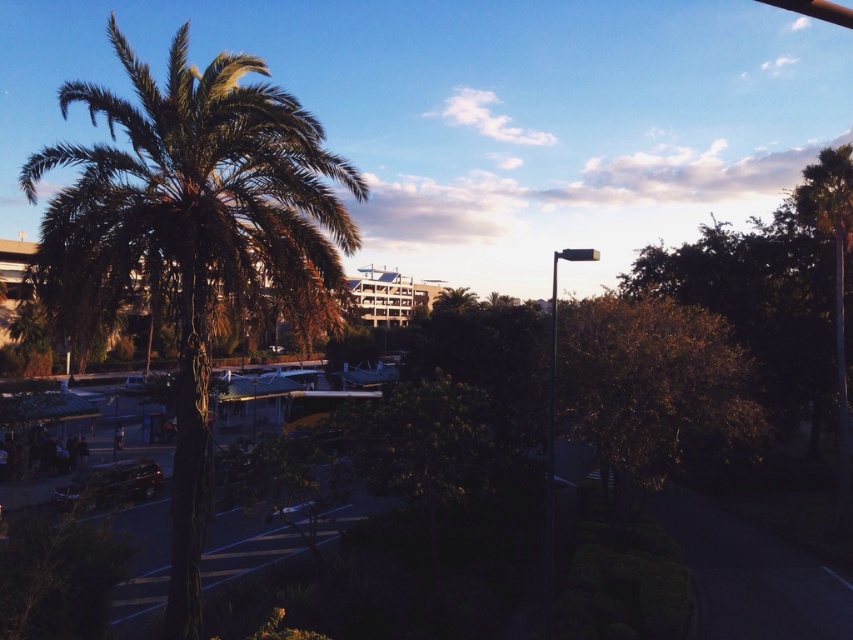
Looking at this image, you are standing in the urban scene depicted in the image. If you want to locate the green leafy palm tree at left, where would you find it in terms of coordinates?

The green leafy palm tree at left is located at coordinates point [194,234].

You are a pedestrian standing at the center of the scene. You want to take a photo of the shiny dark brown car at lower left without the green leafy palm tree at left blocking the view. Is there a way to position yourself so that the palm tree is not in the frame?

The green leafy palm tree at left is located above the shiny dark brown car at lower left. Since the palm tree is above the car, you can position yourself lower or move closer to the car to avoid the palm tree blocking the view.